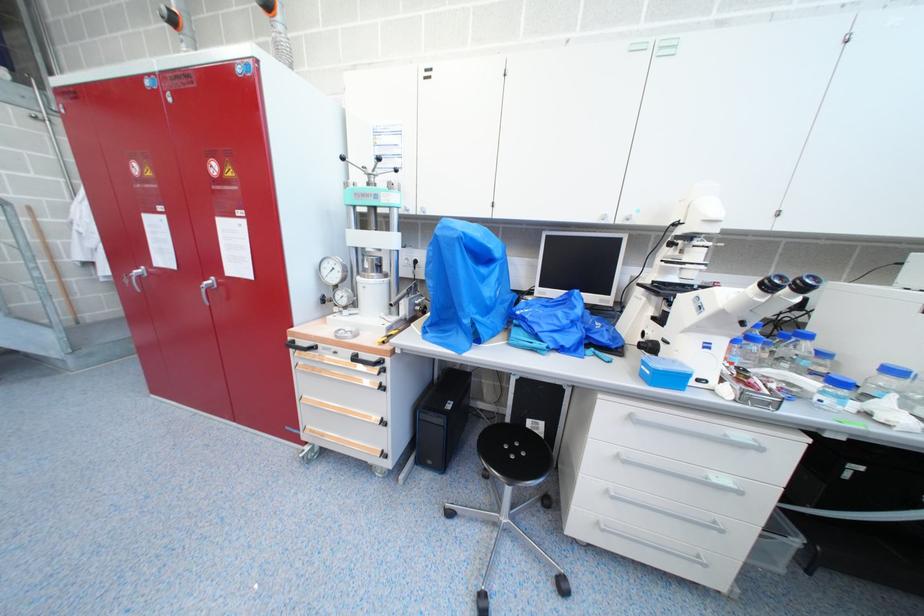
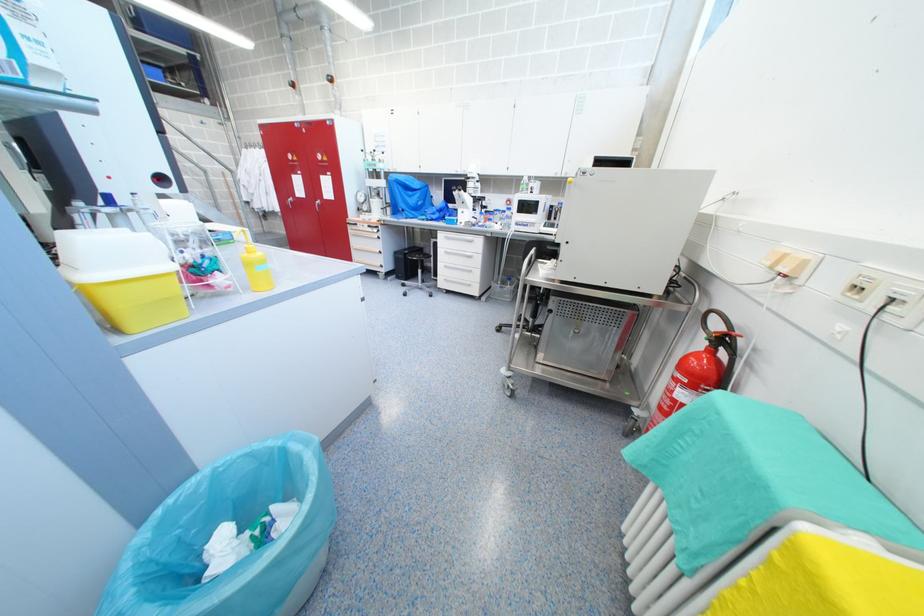
What movement of the cameraman would produce the second image?

The cameraman walked toward right, backward.